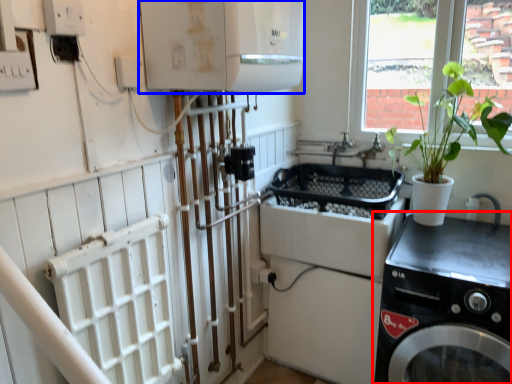
Question: Among these objects, which one is nearest to the camera, washing machine (highlighted by a red box) or appliance (highlighted by a blue box)?

Choices:
 (A) washing machine
 (B) appliance

Answer: (B)